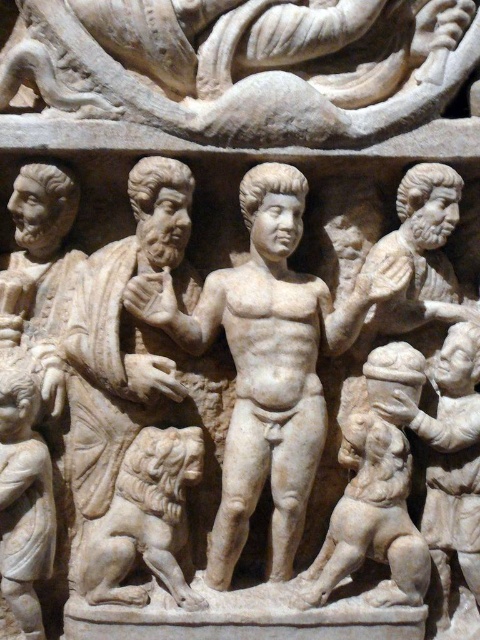
Question: Can you confirm if white marble snake at upper center is positioned below white marble lion at lower left?

Choices:
 (A) yes
 (B) no

Answer: (B)

Question: Does white marble snake at upper center have a lesser width compared to white marble lion at lower left?

Choices:
 (A) no
 (B) yes

Answer: (A)

Question: Which object is farther from the camera taking this photo?

Choices:
 (A) white marble snake at upper center
 (B) white marble lion at lower left

Answer: (B)

Question: Is white marble snake at upper center above white marble lion at lower left?

Choices:
 (A) yes
 (B) no

Answer: (A)